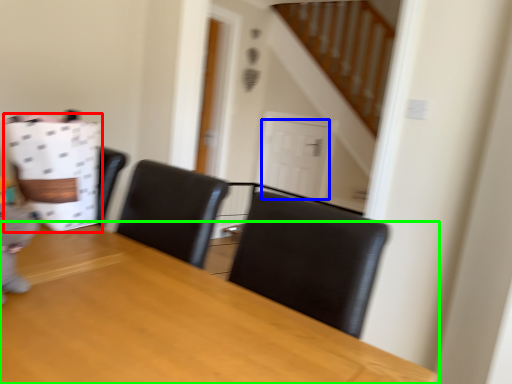
Question: Which object is the farthest from paper bag (highlighted by a red box)? Choose among these: door (highlighted by a blue box) or table (highlighted by a green box).

Choices:
 (A) door
 (B) table

Answer: (A)